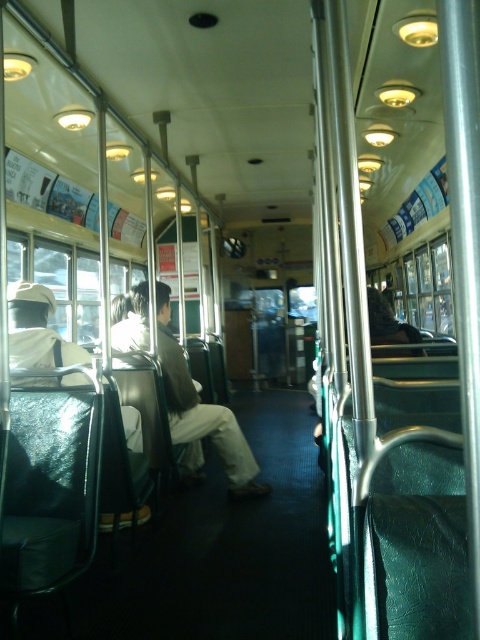
Who is positioned more to the right, light brown fabric pants at center or white matte uniform at left?

From the viewer's perspective, light brown fabric pants at center appears more on the right side.

Between point (187, 467) and point (111, 518), which one is positioned in front?

Point (111, 518) is in front.

Where is `light brown fabric pants at center`? The image size is (480, 640). light brown fabric pants at center is located at coordinates (201, 413).